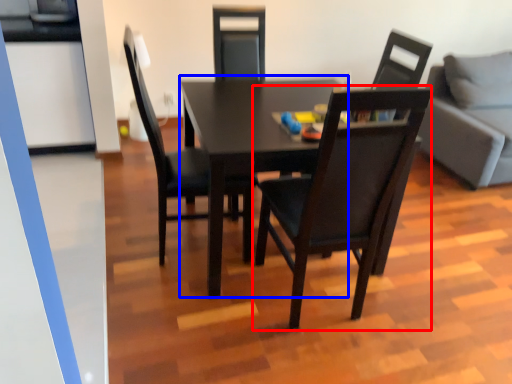
Question: Which of the following is the closest to the observer, chair (highlighted by a red box) or table (highlighted by a blue box)?

Choices:
 (A) chair
 (B) table

Answer: (A)